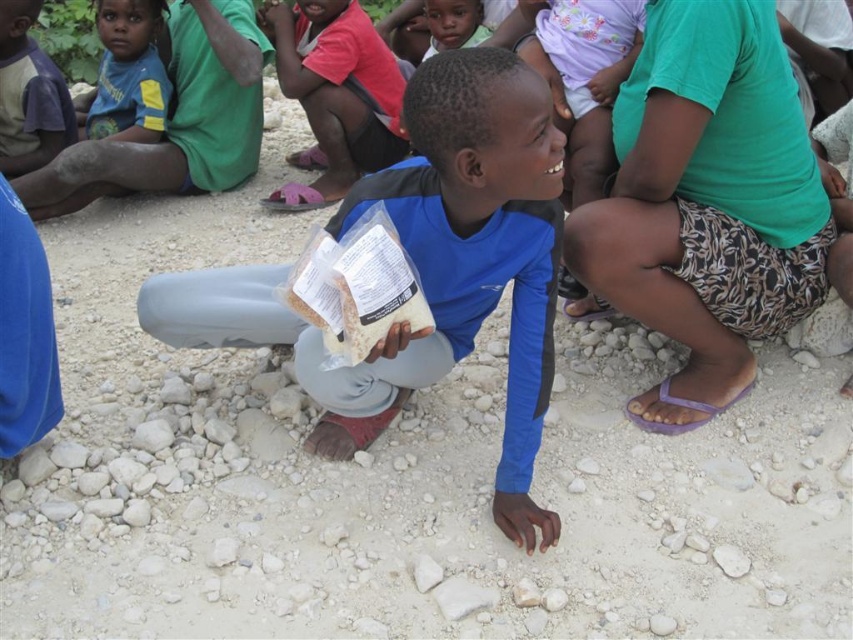
Question: Which of the following is the farthest from the observer?

Choices:
 (A) smooth skin child at center
 (B) green fabric shorts at right
 (C) blue t-shirt at upper left
 (D) blue matte shirt at center

Answer: (A)

Question: Among these objects, which one is farthest from the camera?

Choices:
 (A) blue matte shirt at center
 (B) smooth skin child at center
 (C) green fabric shorts at right
 (D) blue t-shirt at upper left

Answer: (B)

Question: Is green fabric shorts at right above blue t-shirt at upper left?

Choices:
 (A) yes
 (B) no

Answer: (B)

Question: Among these objects, which one is farthest from the camera?

Choices:
 (A) blue t-shirt at upper left
 (B) green fabric shorts at right

Answer: (A)

Question: Is blue matte shirt at center wider than smooth skin child at center?

Choices:
 (A) no
 (B) yes

Answer: (B)

Question: Is the position of blue matte shirt at center more distant than that of green fabric shorts at right?

Choices:
 (A) no
 (B) yes

Answer: (A)